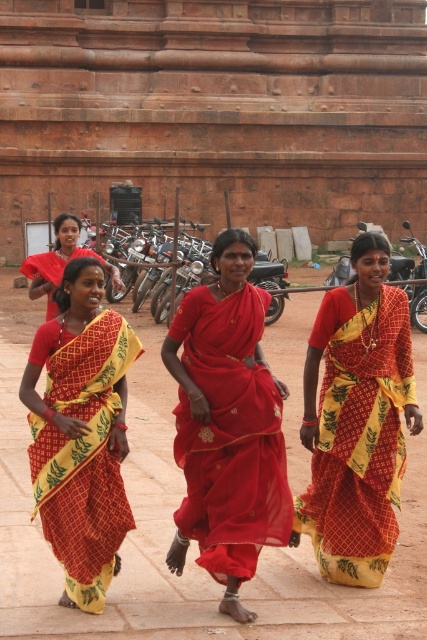
Is matte red sari at center behind red/yellow printed sari at center?

No, matte red sari at center is closer to the viewer.

Between matte red sari at center and red/yellow printed sari at center, which one appears on the right side from the viewer's perspective?

Positioned to the right is matte red sari at center.

Identify the location of matte red sari at center. (227, 426).

Identify the location of red/yellow printed sari at center. tap(81, 433).

Find the location of `red/yellow printed sari at center`. red/yellow printed sari at center is located at coordinates (81, 433).

Does yellow printed sari at center appear under red/yellow printed sari at center?

No, yellow printed sari at center is not below red/yellow printed sari at center.

Is yellow printed sari at center shorter than red/yellow printed sari at center?

Indeed, yellow printed sari at center has a lesser height compared to red/yellow printed sari at center.

Where is `yellow printed sari at center`? The width and height of the screenshot is (427, 640). yellow printed sari at center is located at coordinates (356, 420).